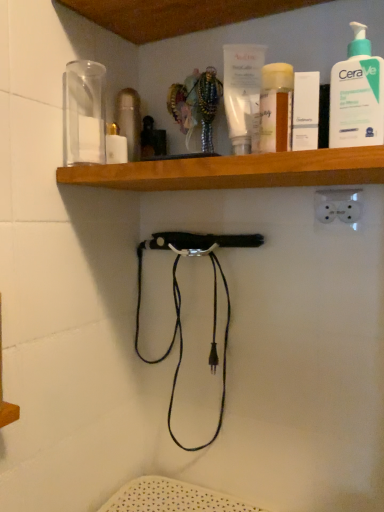
Question: Is wooden at upper center bigger than white pump bottle at upper right?

Choices:
 (A) no
 (B) yes

Answer: (B)

Question: Does wooden at upper center have a lesser height compared to white pump bottle at upper right?

Choices:
 (A) yes
 (B) no

Answer: (A)

Question: Is wooden at upper center next to white pump bottle at upper right?

Choices:
 (A) no
 (B) yes

Answer: (A)

Question: Can you confirm if wooden at upper center is thinner than white pump bottle at upper right?

Choices:
 (A) no
 (B) yes

Answer: (A)

Question: Is wooden at upper center at the left side of white pump bottle at upper right?

Choices:
 (A) no
 (B) yes

Answer: (B)

Question: Can we say wooden at upper center lies outside white pump bottle at upper right?

Choices:
 (A) no
 (B) yes

Answer: (B)

Question: Does white pump bottle at upper right have a smaller size compared to wooden at upper center?

Choices:
 (A) no
 (B) yes

Answer: (B)

Question: Is white pump bottle at upper right positioned beyond the bounds of wooden at upper center?

Choices:
 (A) yes
 (B) no

Answer: (A)

Question: From a real-world perspective, does white pump bottle at upper right sit lower than wooden at upper center?

Choices:
 (A) no
 (B) yes

Answer: (A)

Question: From a real-world perspective, does white pump bottle at upper right stand above wooden at upper center?

Choices:
 (A) yes
 (B) no

Answer: (A)

Question: Does white pump bottle at upper right turn towards wooden at upper center?

Choices:
 (A) yes
 (B) no

Answer: (B)

Question: Does white pump bottle at upper right appear on the right side of wooden at upper center?

Choices:
 (A) no
 (B) yes

Answer: (B)

Question: Considering the relative sizes of white matte box at upper center and wooden at upper center in the image provided, is white matte box at upper center thinner than wooden at upper center?

Choices:
 (A) yes
 (B) no

Answer: (A)